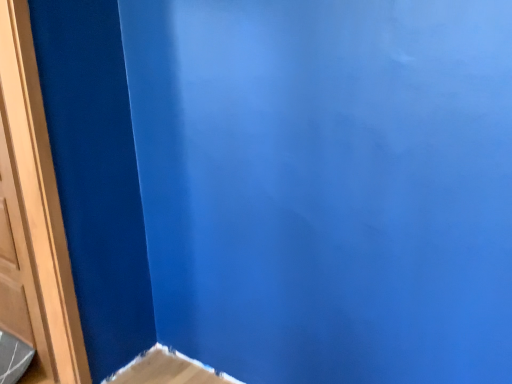
What do you see at coordinates (39, 204) in the screenshot?
I see `matte wood door at left` at bounding box center [39, 204].

Measure the distance between matte wood door at left and camera.

1.55 meters.

The width and height of the screenshot is (512, 384). I want to click on matte wood door at left, so click(39, 204).

At what (x,y) coordinates should I click in order to perform the action: click on matte wood door at left. Please return your answer as a coordinate pair (x, y). The image size is (512, 384). Looking at the image, I should click on (39, 204).